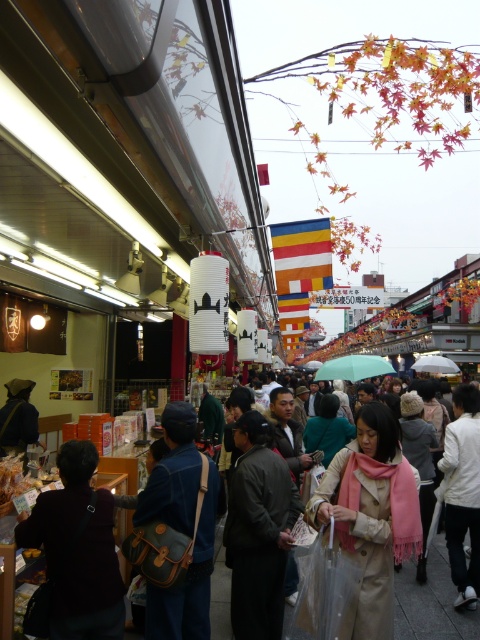
Which is in front, point (86, 464) or point (261, 573)?

Point (86, 464)

Can you confirm if dark brown leather bag at lower left is positioned to the left of dark gray coat at center?

Indeed, dark brown leather bag at lower left is positioned on the left side of dark gray coat at center.

I want to click on dark brown leather bag at lower left, so click(78, 548).

Does beige wool coat at center appear on the right side of denim jacket at center?

Indeed, beige wool coat at center is positioned on the right side of denim jacket at center.

What do you see at coordinates (371, 515) in the screenshot?
I see `beige wool coat at center` at bounding box center [371, 515].

You are a GUI agent. You are given a task and a screenshot of the screen. Output one action in this format:
    pyautogui.click(x=<x>, y=<y>)
    Task: Click on the beige wool coat at center
    This screenshot has height=640, width=480.
    Given the screenshot: What is the action you would take?
    pyautogui.click(x=371, y=515)

Can you confirm if beige wool coat at center is wider than dark gray coat at center?

Yes, beige wool coat at center is wider than dark gray coat at center.

Who is more distant from viewer, (x=383, y=509) or (x=245, y=426)?

The point (x=245, y=426) is more distant.

Between point (370, 556) and point (257, 637), which one is positioned behind?

The point (257, 637) is behind.

Where is `beige wool coat at center`? This screenshot has height=640, width=480. beige wool coat at center is located at coordinates [371, 515].